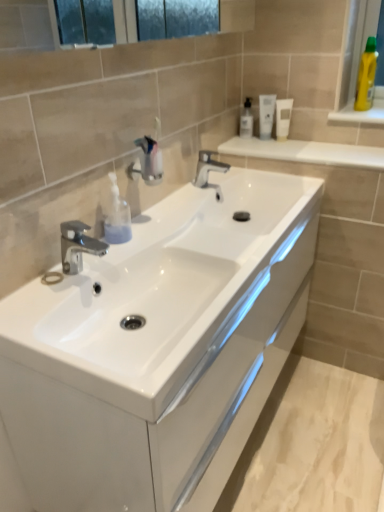
What do you see at coordinates (156, 350) in the screenshot? I see `white glossy cabinet at center` at bounding box center [156, 350].

This screenshot has height=512, width=384. I want to click on white glossy cabinet at center, so click(x=156, y=350).

What are the coordinates of `white glossy shelf at upper right` in the screenshot? It's located at (306, 152).

What do you see at coordinates (246, 119) in the screenshot? This screenshot has height=512, width=384. I see `clear plastic mouthwash at upper center, which is counted as the third mouthwash, starting from the right` at bounding box center [246, 119].

Looking at this image, what is the approximate height of clear plastic mouthwash at upper center, which appears as the first mouthwash when viewed from the left?

clear plastic mouthwash at upper center, which appears as the first mouthwash when viewed from the left, is 6.56 inches in height.

This screenshot has width=384, height=512. Identify the location of white matte tube at upper center, the third mouthwash positioned from the left. (283, 118).

How much space does translucent plastic soap dispenser at center, positioned as the second toiletry in back-to-front order, occupy horizontally?

2.81 inches.

This screenshot has height=512, width=384. I want to click on white glossy cabinet at center, so click(x=156, y=350).

In the scene shown: Which object is wider, white glossy cabinet at center or white glossy tube at upper right, which is the 2th mouthwash from left to right?

white glossy cabinet at center is wider.

Is the depth of white glossy cabinet at center greater than that of white glossy tube at upper right, which ranks as the 2th mouthwash in right-to-left order?

No, it is in front of white glossy tube at upper right, which ranks as the 2th mouthwash in right-to-left order.

You are a GUI agent. You are given a task and a screenshot of the screen. Output one action in this format:
    pyautogui.click(x=<x>, y=<y>)
    Task: Click on the mouthwash that is the 2nd one when counting backward from the white glossy cabinet at center
    The image size is (384, 512).
    Given the screenshot: What is the action you would take?
    pyautogui.click(x=266, y=115)

Based on the photo, from the image's perspective, is white glossy cabinet at center above white glossy tube at upper right, which is the 2th mouthwash from left to right?

No, from the image's perspective, white glossy cabinet at center is not over white glossy tube at upper right, which is the 2th mouthwash from left to right.

Is white glossy tube at upper right, which is the 2th mouthwash from left to right, wider than polished chrome tap at center, the second tap from the bottom?

No, white glossy tube at upper right, which is the 2th mouthwash from left to right, is not wider than polished chrome tap at center, the second tap from the bottom.

This screenshot has width=384, height=512. I want to click on the 1st tap to the left of the white glossy tube at upper right, which ranks as the 2th mouthwash in right-to-left order, counting from the anchor's position, so click(x=208, y=170).

Who is smaller, white glossy tube at upper right, which ranks as the 2th mouthwash in right-to-left order, or polished chrome tap at center, which is counted as the 2th tap, starting from the front?

With smaller size is white glossy tube at upper right, which ranks as the 2th mouthwash in right-to-left order.

From the image's perspective, would you say translucent plastic soap dispenser at center, which is the first toiletry in left-to-right order, is shown under white matte tube at upper center, placed as the 1th mouthwash when sorted from right to left?

Yes.

Based on the photo, who is shorter, translucent plastic soap dispenser at center, which is the first toiletry in left-to-right order, or white matte tube at upper center, the third mouthwash positioned from the left?

Standing shorter between the two is white matte tube at upper center, the third mouthwash positioned from the left.

Is translucent plastic soap dispenser at center, which is the first toiletry in left-to-right order, to the right of white matte tube at upper center, the third mouthwash positioned from the left, from the viewer's perspective?

No, translucent plastic soap dispenser at center, which is the first toiletry in left-to-right order, is not to the right of white matte tube at upper center, the third mouthwash positioned from the left.

Locate an element on the screen. This screenshot has width=384, height=512. toiletry below the white matte tube at upper center, placed as the 1th mouthwash when sorted from right to left (from the image's perspective) is located at coordinates (115, 214).

Is white glossy tube at upper right, which ranks as the 2th mouthwash in right-to-left order, positioned with its back to white glossy cabinet at center?

white glossy tube at upper right, which ranks as the 2th mouthwash in right-to-left order, is not turned away from white glossy cabinet at center.

Between white glossy tube at upper right, which is the 2th mouthwash from left to right, and white glossy cabinet at center, which one is positioned behind?

white glossy tube at upper right, which is the 2th mouthwash from left to right.

Which of these two, white glossy tube at upper right, which is the 2th mouthwash from left to right, or white glossy cabinet at center, is bigger?

With larger size is white glossy cabinet at center.

Considering the sizes of white glossy tube at upper right, which is the 2th mouthwash from left to right, and white glossy cabinet at center in the image, is white glossy tube at upper right, which is the 2th mouthwash from left to right, wider or thinner than white glossy cabinet at center?

white glossy tube at upper right, which is the 2th mouthwash from left to right, is thinner than white glossy cabinet at center.

Is translucent plastic soap dispenser at center, positioned as the second toiletry in back-to-front order, facing towards metallic chrome faucet at center?

No, translucent plastic soap dispenser at center, positioned as the second toiletry in back-to-front order, is not aimed at metallic chrome faucet at center.

Is translucent plastic soap dispenser at center, placed as the second toiletry when sorted from top to bottom, closer to the viewer compared to metallic chrome faucet at center?

Yes, the depth of translucent plastic soap dispenser at center, placed as the second toiletry when sorted from top to bottom, is less than that of metallic chrome faucet at center.

From a real-world perspective, relative to metallic chrome faucet at center, is translucent plastic soap dispenser at center, positioned as the second toiletry in back-to-front order, vertically above or below?

translucent plastic soap dispenser at center, positioned as the second toiletry in back-to-front order, is situated lower than metallic chrome faucet at center in the real world.

How many degrees apart are the facing directions of translucent plastic soap dispenser at center, acting as the first toiletry starting from the front, and metallic chrome faucet at center?

The angular difference between translucent plastic soap dispenser at center, acting as the first toiletry starting from the front, and metallic chrome faucet at center is 0.00107 degrees.

From a real-world perspective, which object stands above the other?

white glossy tube at upper right, which ranks as the 2th mouthwash in right-to-left order, is physically above.

Is polished chrome tap at center, acting as the 1th tap starting from the right, taller than white glossy tube at upper right, which ranks as the 2th mouthwash in right-to-left order?

Incorrect, the height of polished chrome tap at center, acting as the 1th tap starting from the right, is not larger of that of white glossy tube at upper right, which ranks as the 2th mouthwash in right-to-left order.

From the image's perspective, does polished chrome tap at center, which is the 1th tap from top to bottom, appear higher than white glossy tube at upper right, which is the 2th mouthwash from left to right?

No, from the image's perspective, polished chrome tap at center, which is the 1th tap from top to bottom, is not over white glossy tube at upper right, which is the 2th mouthwash from left to right.

Is point (164, 342) closer to camera compared to point (249, 124)?

Yes, it is in front of point (249, 124).

Can you tell me how much white glossy cabinet at center and clear plastic mouthwash at upper center, which is counted as the third mouthwash, starting from the right, differ in facing direction?

The angle between the facing direction of white glossy cabinet at center and the facing direction of clear plastic mouthwash at upper center, which is counted as the third mouthwash, starting from the right, is 89.7 degrees.

Considering their positions, is white glossy cabinet at center located in front of or behind clear plastic mouthwash at upper center, which appears as the first mouthwash when viewed from the left?

Clearly, white glossy cabinet at center is in front of clear plastic mouthwash at upper center, which appears as the first mouthwash when viewed from the left.

Is white glossy cabinet at center located outside clear plastic mouthwash at upper center, which appears as the first mouthwash when viewed from the left?

That's correct, white glossy cabinet at center is outside of clear plastic mouthwash at upper center, which appears as the first mouthwash when viewed from the left.

The image size is (384, 512). In order to click on bathroom cabinet in front of the white glossy tube at upper right, which is the 2th mouthwash from left to right in this screenshot , I will do `click(156, 350)`.

Locate an element on the screen. This screenshot has height=512, width=384. mouthwash that is the 2nd object located behind the polished chrome tap at center, the second tap from the bottom is located at coordinates (266, 115).

When comparing their distances from yellow plastic bottle at upper right, the second toiletry viewed from the left, does clear plastic mouthwash at upper center, which is counted as the third mouthwash, starting from the right, or polished chrome tap at left, the first tap in the bottom-to-top sequence, seem closer?

Among the two, clear plastic mouthwash at upper center, which is counted as the third mouthwash, starting from the right, is located nearer to yellow plastic bottle at upper right, the second toiletry viewed from the left.

In the scene shown: Estimate the real-world distances between objects in this image. Which object is closer to white matte tube at upper center, placed as the 1th mouthwash when sorted from right to left, translucent plastic soap dispenser at center, acting as the first toiletry starting from the front, or white glossy shelf at upper right?

Among the two, white glossy shelf at upper right is located nearer to white matte tube at upper center, placed as the 1th mouthwash when sorted from right to left.

From the image, which object appears to be farther from metallic chrome faucet at center, polished chrome tap at center, acting as the 1th tap starting from the right, or white glossy tube at upper right, which ranks as the 2th mouthwash in right-to-left order?

white glossy tube at upper right, which ranks as the 2th mouthwash in right-to-left order, lies further to metallic chrome faucet at center than the other object.

Based on their spatial positions, is polished chrome tap at left, the first tap in the bottom-to-top sequence, or clear plastic mouthwash at upper center, which appears as the first mouthwash when viewed from the left, further from white glossy cabinet at center?

Based on the image, clear plastic mouthwash at upper center, which appears as the first mouthwash when viewed from the left, appears to be further to white glossy cabinet at center.

Which object lies nearer to the anchor point white glossy shelf at upper right, white glossy cabinet at center or metallic chrome faucet at center?

The object closer to white glossy shelf at upper right is metallic chrome faucet at center.

From the image, which object appears to be nearer to polished chrome tap at left, the first tap in the bottom-to-top sequence, white matte tube at upper center, the third mouthwash positioned from the left, or white glossy tube at upper right, which ranks as the 2th mouthwash in right-to-left order?

Among the two, white glossy tube at upper right, which ranks as the 2th mouthwash in right-to-left order, is located nearer to polished chrome tap at left, the first tap in the bottom-to-top sequence.

From the image, which object appears to be farther from translucent plastic soap dispenser at center, acting as the first toiletry starting from the front, metallic chrome faucet at center or polished chrome tap at center, acting as the 1th tap starting from the right?

Among the two, polished chrome tap at center, acting as the 1th tap starting from the right, is located further to translucent plastic soap dispenser at center, acting as the first toiletry starting from the front.

When comparing their distances from polished chrome tap at center, which is the second tap from left to right, does yellow plastic bottle at upper right, the second toiletry viewed from the front, or translucent plastic soap dispenser at center, which is the second toiletry from right to left, seem closer?

translucent plastic soap dispenser at center, which is the second toiletry from right to left, is closer to polished chrome tap at center, which is the second tap from left to right.

Where is `balustrade located between polished chrome tap at center, which is the second tap from left to right, and yellow plastic bottle at upper right, the second toiletry viewed from the left, in the left-right direction`? This screenshot has width=384, height=512. balustrade located between polished chrome tap at center, which is the second tap from left to right, and yellow plastic bottle at upper right, the second toiletry viewed from the left, in the left-right direction is located at coordinates (306, 152).

This screenshot has width=384, height=512. In order to click on plumbing fixture between polished chrome tap at left, which is counted as the 2th tap, starting from the back, and polished chrome tap at center, the second tap from the bottom, in the front-back direction in this screenshot , I will do `click(147, 161)`.

Identify the location of tap positioned between translucent plastic soap dispenser at center, placed as the second toiletry when sorted from top to bottom, and white matte tube at upper center, the third mouthwash positioned from the left, from near to far. The height and width of the screenshot is (512, 384). (208, 170).

Identify the location of plumbing fixture positioned between polished chrome tap at left, which is the first tap in left-to-right order, and white glossy tube at upper right, which is the 2th mouthwash from left to right, from near to far. (147, 161).